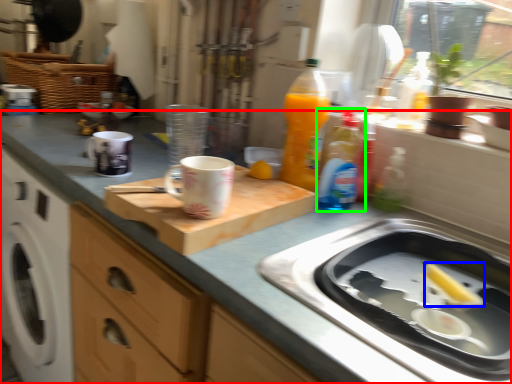
Question: Which object is the closest to the countertop (highlighted by a red box)? Choose among these: food (highlighted by a blue box) or bottle (highlighted by a green box).

Choices:
 (A) food
 (B) bottle

Answer: (B)